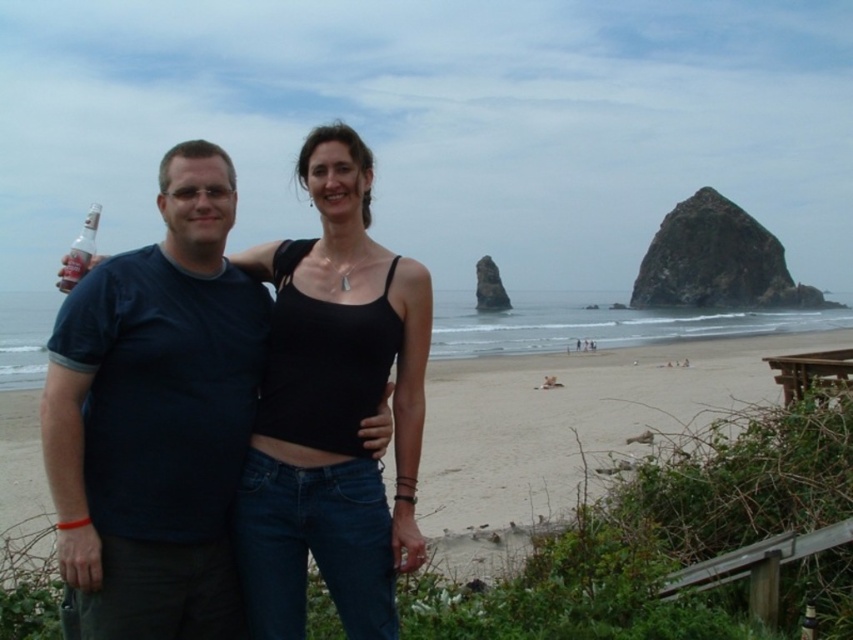
Question: Which point is farther to the camera?

Choices:
 (A) (556, 456)
 (B) (227, 365)

Answer: (A)

Question: Which point is farther from the camera taking this photo?

Choices:
 (A) (527, 518)
 (B) (151, 371)

Answer: (A)

Question: Is dark blue t-shirt at left to the left of smooth sand beach at center from the viewer's perspective?

Choices:
 (A) yes
 (B) no

Answer: (A)

Question: Is dark blue t-shirt at left smaller than smooth sand beach at center?

Choices:
 (A) yes
 (B) no

Answer: (A)

Question: From the image, what is the correct spatial relationship of dark blue t-shirt at left in relation to smooth sand beach at center?

Choices:
 (A) below
 (B) above

Answer: (B)